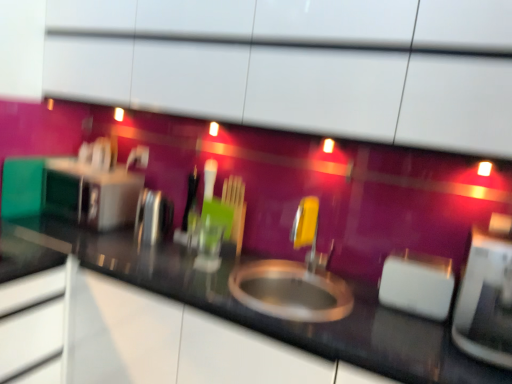
Question: From a real-world perspective, relative to white plastic toaster at right, which ranks as the third appliance in left-to-right order, is black glossy countertop at center vertically above or below?

Choices:
 (A) below
 (B) above

Answer: (A)

Question: Visually, is black glossy countertop at center positioned to the left or to the right of white plastic toaster at right, which ranks as the third appliance in back-to-front order?

Choices:
 (A) left
 (B) right

Answer: (A)

Question: Which is farther from the satin silver toaster at left, the 4th appliance positioned from the front?

Choices:
 (A) polished stainless steel kettle at left, which is the 2th appliance in left-to-right order
 (B) yellow plastic faucet at center
 (C) white plastic toaster at right, which ranks as the third appliance in back-to-front order
 (D) black glossy countertop at center
 (E) white glossy toaster at right, acting as the first appliance starting from the front

Answer: (E)

Question: Which object is positioned closest to the yellow plastic faucet at center?

Choices:
 (A) satin silver toaster at left, the 1th appliance viewed from the left
 (B) white plastic toaster at right, arranged as the 2th appliance when viewed from the front
 (C) white glossy toaster at right, acting as the first appliance starting from the front
 (D) black glossy countertop at center
 (E) polished stainless steel kettle at left, which is the 2th appliance in left-to-right order

Answer: (B)